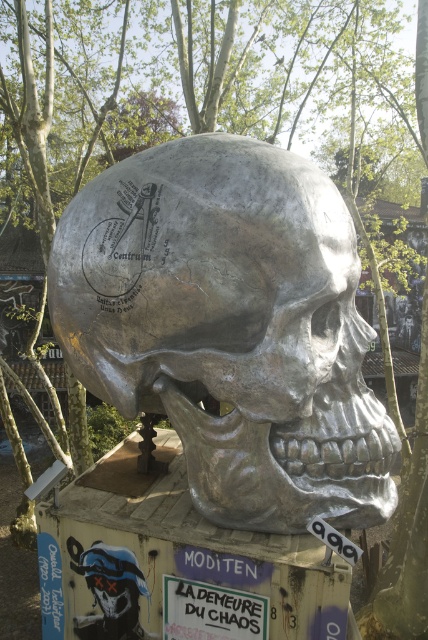
You are an art curator planning to display both the shiny silver skull at center and the blue glossy skull at lower left in a new exhibition. Given their sizes, which one should be placed on the taller pedestal to maintain visual balance?

The shiny silver skull at center is taller than the blue glossy skull at lower left, so it should be placed on the taller pedestal to maintain visual balance.